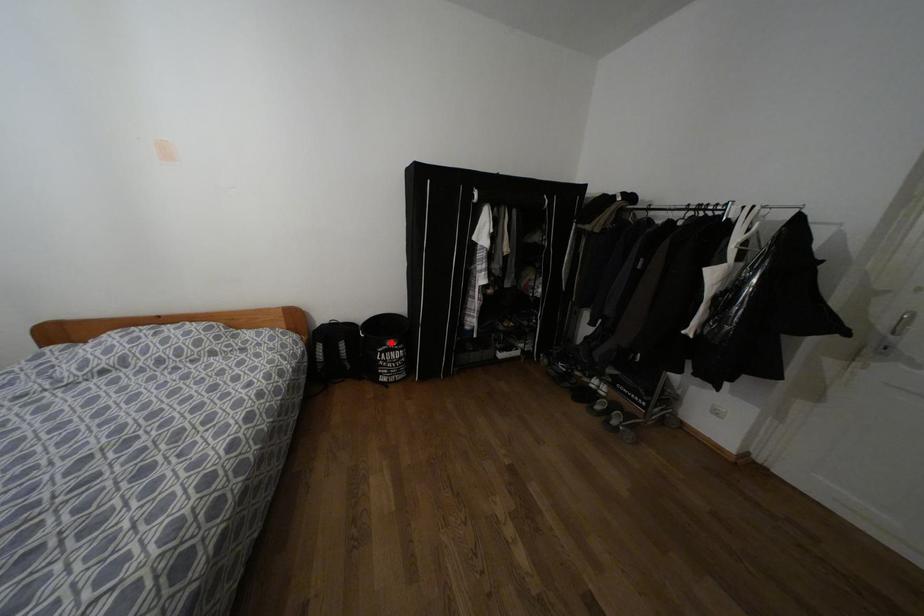
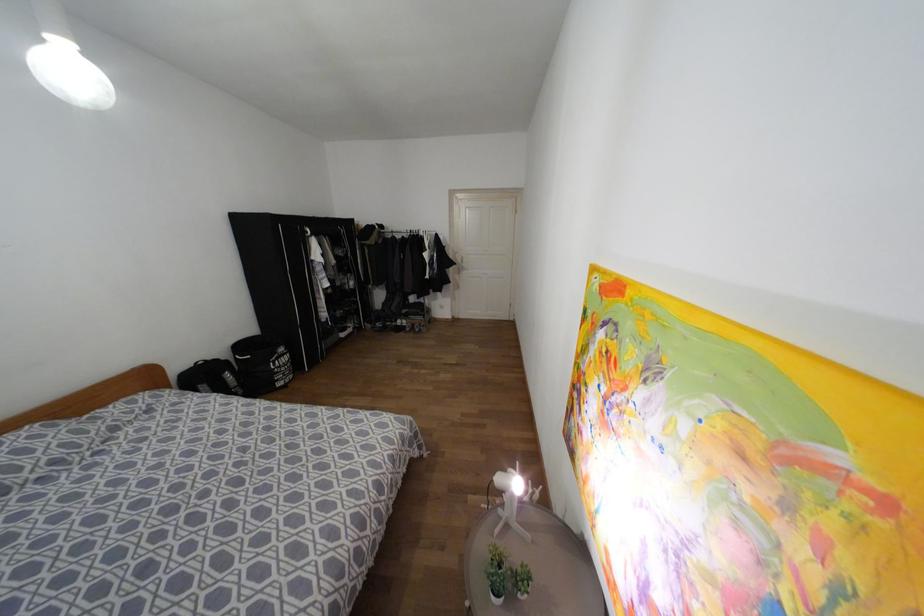
Question: I am providing you with two images of the same scene from different viewpoints. A red point is shown in image1. For the corresponding object point in image2, is it positioned nearer or farther from the camera?

Choices:
 (A) Nearer
 (B) Farther

Answer: (A)